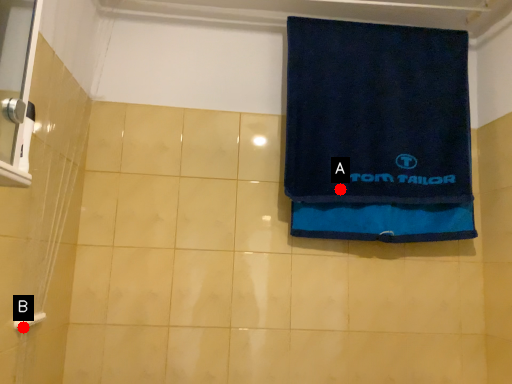
Question: Two points are circled on the image, labeled by A and B beside each circle. Which point is closer to the camera?

Choices:
 (A) A is closer
 (B) B is closer

Answer: (B)